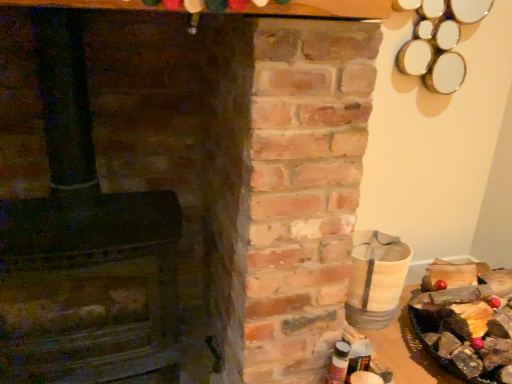
Describe the element at coordinates (159, 190) in the screenshot. The image size is (512, 384). I see `rustic brick fireplace at left` at that location.

The width and height of the screenshot is (512, 384). I want to click on rustic brick fireplace at left, so click(x=159, y=190).

Describe the element at coordinates (465, 318) in the screenshot. I see `wooden log at right` at that location.

Image resolution: width=512 pixels, height=384 pixels. In order to click on wooden log at right in this screenshot , I will do [x=465, y=318].

You are a GUI agent. You are given a task and a screenshot of the screen. Output one action in this format:
    pyautogui.click(x=<x>, y=<y>)
    Task: Click on the rustic brick fireplace at left
    The width and height of the screenshot is (512, 384).
    Given the screenshot: What is the action you would take?
    pyautogui.click(x=159, y=190)

Which is more to the right, wooden log at right or rustic brick fireplace at left?

Positioned to the right is wooden log at right.

Relative to rustic brick fireplace at left, is wooden log at right in front or behind?

wooden log at right is behind rustic brick fireplace at left.

Which is closer, (445, 264) or (272, 167)?

The point (272, 167) is more forward.

From the image's perspective, is wooden log at right on top of rustic brick fireplace at left?

No, from the image's perspective, wooden log at right is not above rustic brick fireplace at left.

From a real-world perspective, is wooden log at right over rustic brick fireplace at left?

No, from a real-world perspective, wooden log at right is not over rustic brick fireplace at left

Which object is thinner, wooden log at right or rustic brick fireplace at left?

rustic brick fireplace at left.

Considering the sizes of wooden log at right and rustic brick fireplace at left in the image, is wooden log at right taller or shorter than rustic brick fireplace at left?

Clearly, wooden log at right is shorter compared to rustic brick fireplace at left.

Does wooden log at right have a smaller size compared to rustic brick fireplace at left?

Yes.

Based on the photo, can rustic brick fireplace at left be found inside wooden log at right?

No, wooden log at right does not contain rustic brick fireplace at left.

Are wooden log at right and rustic brick fireplace at left beside each other?

wooden log at right and rustic brick fireplace at left are not in contact.

Is wooden log at right oriented towards rustic brick fireplace at left?

No.

From the picture: How different are the orientations of wooden log at right and rustic brick fireplace at left in degrees?

1.57 degrees separate the facing orientations of wooden log at right and rustic brick fireplace at left.

In the image, there is a rustic brick fireplace at left. Where is `food below it (from a real-world perspective)`? Image resolution: width=512 pixels, height=384 pixels. food below it (from a real-world perspective) is located at coordinates (465, 318).

Considering the relative positions of rustic brick fireplace at left and wooden log at right in the image provided, is rustic brick fireplace at left to the left or to the right of wooden log at right?

Based on their positions, rustic brick fireplace at left is located to the left of wooden log at right.

Is rustic brick fireplace at left behind wooden log at right?

No, rustic brick fireplace at left is in front of wooden log at right.

Is point (356, 147) positioned behind point (467, 291)?

That is False.

From the image's perspective, is rustic brick fireplace at left beneath wooden log at right?

No.

From a real-world perspective, is rustic brick fireplace at left beneath wooden log at right?

Incorrect, from a real-world perspective, rustic brick fireplace at left is higher than wooden log at right.

Which of these two, rustic brick fireplace at left or wooden log at right, is thinner?

rustic brick fireplace at left.

Is rustic brick fireplace at left taller than wooden log at right?

Yes.

Which of these two, rustic brick fireplace at left or wooden log at right, is bigger?

With larger size is rustic brick fireplace at left.

Would you say rustic brick fireplace at left is outside wooden log at right?

That's correct, rustic brick fireplace at left is outside of wooden log at right.

Is rustic brick fireplace at left not near wooden log at right?

Indeed, rustic brick fireplace at left is not near wooden log at right.

From the picture: Could you tell me if rustic brick fireplace at left is turned towards wooden log at right?

No, rustic brick fireplace at left is not turned towards wooden log at right.

How many degrees apart are the facing directions of rustic brick fireplace at left and wooden log at right?

They differ by 1.57 degrees in their facing directions.

In the image, there is a wooden log at right. At what (x,y) coordinates should I click in order to perform the action: click on fireplace above it (from the image's perspective). Please return your answer as a coordinate pair (x, y). The width and height of the screenshot is (512, 384). Looking at the image, I should click on (159, 190).

The height and width of the screenshot is (384, 512). I want to click on fireplace on the left of wooden log at right, so click(x=159, y=190).

Identify the location of fireplace lying above the wooden log at right (from the image's perspective). (159, 190).